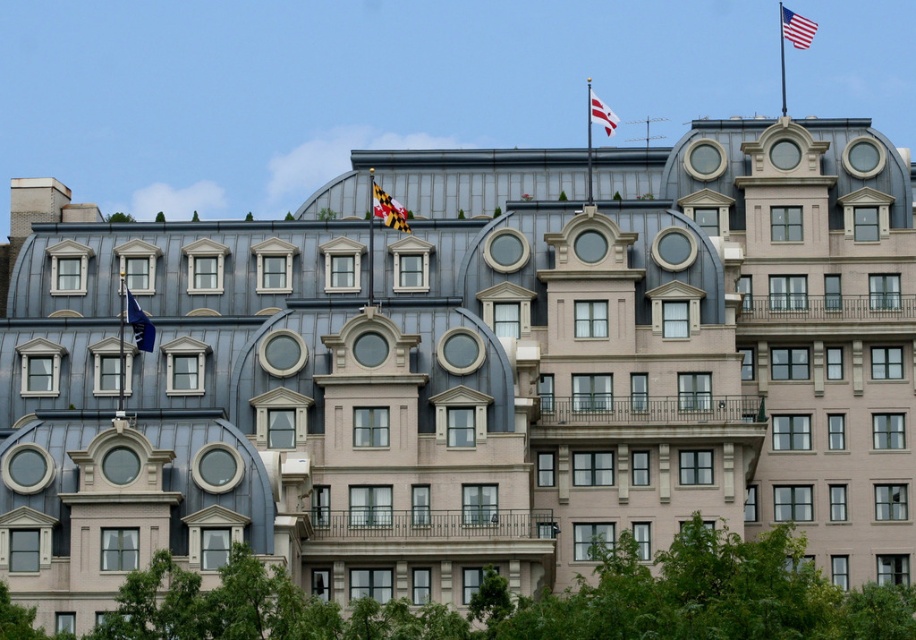
Is maryland state flag at center above blue fabric flag at left?

Yes, maryland state flag at center is above blue fabric flag at left.

Is point (402, 212) farther from viewer compared to point (151, 323)?

That is True.

Image resolution: width=916 pixels, height=640 pixels. I want to click on maryland state flag at center, so click(x=388, y=209).

Is point (144, 324) positioned behind point (595, 108)?

No, it is in front of (595, 108).

Who is more distant from viewer, (x=154, y=333) or (x=601, y=113)?

Positioned behind is point (x=601, y=113).

This screenshot has width=916, height=640. In order to click on blue fabric flag at left in this screenshot , I will do `click(139, 323)`.

Is point (376, 188) in front of point (781, 19)?

Yes.

Identify the location of maryland state flag at center. (388, 209).

Describe the element at coordinates (388, 209) in the screenshot. The width and height of the screenshot is (916, 640). I see `maryland state flag at center` at that location.

You are a GUI agent. You are given a task and a screenshot of the screen. Output one action in this format:
    pyautogui.click(x=<x>, y=<y>)
    Task: Click on the maryland state flag at center
    This screenshot has width=916, height=640.
    Given the screenshot: What is the action you would take?
    pyautogui.click(x=388, y=209)